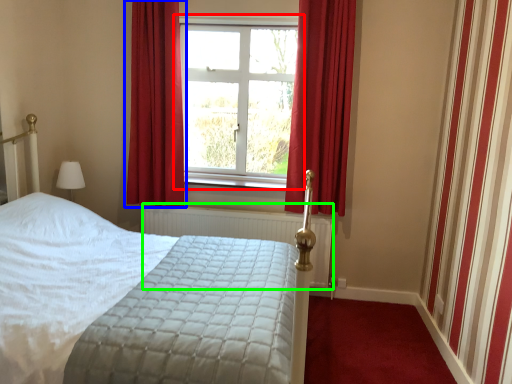
Question: Considering the real-world distances, which object is farthest from window (highlighted by a red box)? curtain (highlighted by a blue box) or radiator (highlighted by a green box)?

Choices:
 (A) curtain
 (B) radiator

Answer: (B)